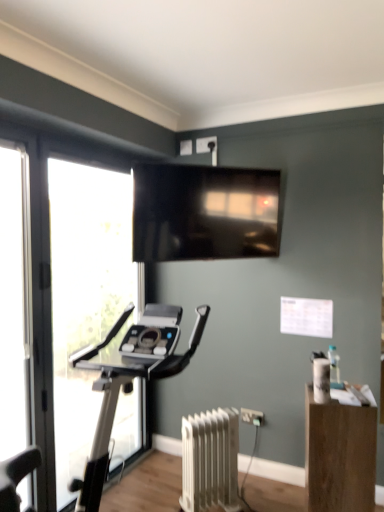
Question: Considering their positions, is wooden box at lower right located in front of or behind clear glass screen door at left?

Choices:
 (A) front
 (B) behind

Answer: (B)

Question: From the image's perspective, relative to clear glass screen door at left, is wooden box at lower right above or below?

Choices:
 (A) below
 (B) above

Answer: (A)

Question: Which of these objects is positioned closest to the clear glass screen door at left?

Choices:
 (A) wooden box at lower right
 (B) transparent glass window at left
 (C) matte black tv at upper center
 (D) white matte radiator at lower center

Answer: (B)

Question: Which object is the farthest from the wooden box at lower right?

Choices:
 (A) clear glass screen door at left
 (B) matte black tv at upper center
 (C) white matte radiator at lower center
 (D) transparent glass window at left

Answer: (A)